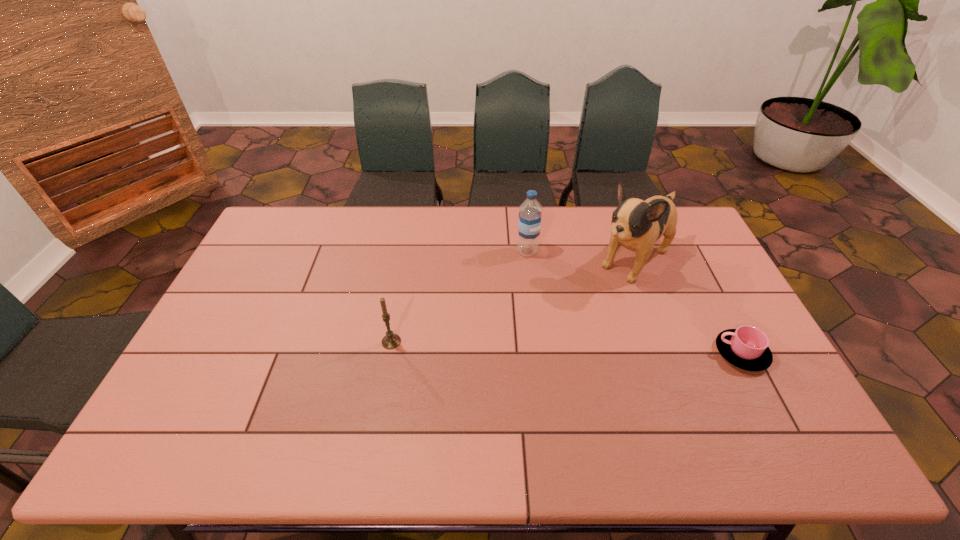
Identify the location of free area in between the cup and the water bottle. (635, 302).

Locate an element on the screen. This screenshot has height=540, width=960. empty space between the second object from left to right and the puppy is located at coordinates (581, 255).

Image resolution: width=960 pixels, height=540 pixels. What are the coordinates of `free point between the second tallest object and the second shortest object` in the screenshot? It's located at (459, 296).

The width and height of the screenshot is (960, 540). Find the location of `blank region between the tallest object and the shortest object`. blank region between the tallest object and the shortest object is located at coordinates (687, 306).

The height and width of the screenshot is (540, 960). Identify the location of unoccupied position between the third shortest object and the cup. tap(635, 302).

Identify the location of vacant region between the shortest object and the second tallest object. The height and width of the screenshot is (540, 960). (635, 302).

Select which object appears as the third closest to the shortest object. Please provide its 2D coordinates. Your answer should be formatted as a tuple, i.e. [(x, y)], where the tuple contains the x and y coordinates of a point satisfying the conditions above.

[(390, 341)]

Select which object is the third closest to the leftmost object. Please provide its 2D coordinates. Your answer should be formatted as a tuple, i.e. [(x, y)], where the tuple contains the x and y coordinates of a point satisfying the conditions above.

[(746, 347)]

Find the location of a particular element. The width and height of the screenshot is (960, 540). free spot that satisfies the following two spatial constraints: 1. on the front side of the puppy; 2. on the side with the handle of the shortest object is located at coordinates (669, 353).

Find the location of a particular element. The image size is (960, 540). free space that satisfies the following two spatial constraints: 1. on the back side of the candle; 2. on the right side of the tallest object is located at coordinates (406, 259).